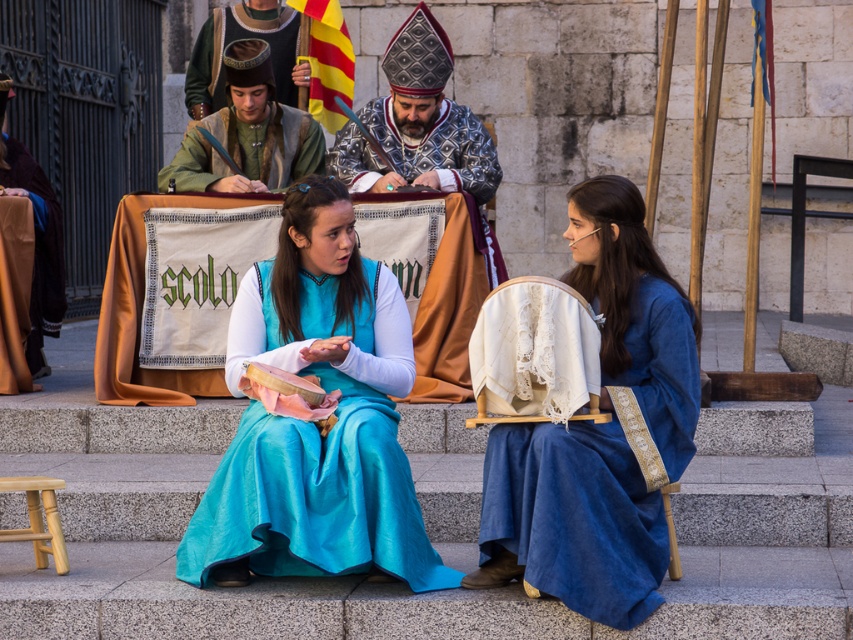
Question: Does blue velvet dress at center have a smaller size compared to green woolen tunic at center?

Choices:
 (A) no
 (B) yes

Answer: (A)

Question: Is silver metallic bishop's hat at upper center closer to the viewer compared to green woolen tunic at center?

Choices:
 (A) yes
 (B) no

Answer: (B)

Question: Which of the following is the closest to the observer?

Choices:
 (A) green woolen tunic at center
 (B) matte blue dress at center
 (C) silver metallic bishop's hat at upper center

Answer: (B)

Question: Which of the following is the closest to the observer?

Choices:
 (A) blue velvet dress at center
 (B) silver metallic bishop's hat at upper center

Answer: (A)

Question: Can you confirm if matte blue dress at center is positioned to the left of green woolen tunic at upper center?

Choices:
 (A) no
 (B) yes

Answer: (A)

Question: Which point appears closest to the camera in this image?

Choices:
 (A) (314, 317)
 (B) (613, 291)

Answer: (B)